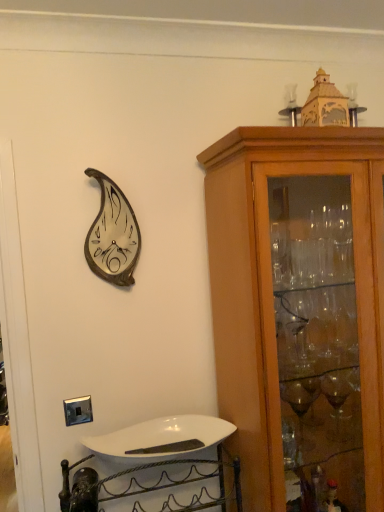
This screenshot has height=512, width=384. What do you see at coordinates (300, 311) in the screenshot?
I see `light brown wood cabinet at right` at bounding box center [300, 311].

Image resolution: width=384 pixels, height=512 pixels. Identify the location of white glossy sink at lower center. (155, 468).

The image size is (384, 512). I want to click on light brown wood cabinet at right, so click(x=300, y=311).

Looking at this image, is light brown wood cabinet at right smaller than metallic silver clock at upper left?

Actually, light brown wood cabinet at right might be larger than metallic silver clock at upper left.

From the image's perspective, would you say light brown wood cabinet at right is positioned over metallic silver clock at upper left?

Actually, light brown wood cabinet at right appears below metallic silver clock at upper left in the image.

Considering the points (366, 458) and (119, 202), which point is in front, point (366, 458) or point (119, 202)?

Point (366, 458)

Is metallic silver clock at upper left located within light brown wood cabinet at right?

No.

Do you think white glossy sink at lower center is within light brown wood cabinet at right, or outside of it?

white glossy sink at lower center lies outside light brown wood cabinet at right.

Between white glossy sink at lower center and light brown wood cabinet at right, which one has less height?

Standing shorter between the two is white glossy sink at lower center.

Does white glossy sink at lower center come behind light brown wood cabinet at right?

Yes, it is.

Does white glossy sink at lower center appear on the right side of light brown wood cabinet at right?

Incorrect, white glossy sink at lower center is not on the right side of light brown wood cabinet at right.

From a real-world perspective, is white glossy sink at lower center located higher than metallic silver clock at upper left?

No, from a real-world perspective, white glossy sink at lower center is not over metallic silver clock at upper left

Is white glossy sink at lower center oriented towards metallic silver clock at upper left?

No, white glossy sink at lower center does not turn towards metallic silver clock at upper left.

From the image's perspective, which is below, white glossy sink at lower center or metallic silver clock at upper left?

white glossy sink at lower center, from the image's perspective.

Which is behind, point (142, 469) or point (101, 277)?

The point (142, 469) is behind.

Is metallic silver clock at upper left spatially inside light brown wood cabinet at right, or outside of it?

metallic silver clock at upper left is not inside light brown wood cabinet at right, it's outside.

How many degrees apart are the facing directions of metallic silver clock at upper left and light brown wood cabinet at right?

There is a 1.32-degree angle between the facing directions of metallic silver clock at upper left and light brown wood cabinet at right.

Can you confirm if metallic silver clock at upper left is wider than light brown wood cabinet at right?

Incorrect, the width of metallic silver clock at upper left does not surpass that of light brown wood cabinet at right.

Does light brown wood cabinet at right lie in front of white glossy sink at lower center?

Yes, it is.

Would you say light brown wood cabinet at right is outside white glossy sink at lower center?

light brown wood cabinet at right lies outside white glossy sink at lower center's area.

Which is correct: metallic silver clock at upper left is inside white glossy sink at lower center, or outside of it?

metallic silver clock at upper left lies outside white glossy sink at lower center.

Does metallic silver clock at upper left have a greater height compared to white glossy sink at lower center?

Correct, metallic silver clock at upper left is much taller as white glossy sink at lower center.

Does metallic silver clock at upper left turn towards white glossy sink at lower center?

No, metallic silver clock at upper left does not turn towards white glossy sink at lower center.

The width and height of the screenshot is (384, 512). Identify the location of clock above the light brown wood cabinet at right (from the image's perspective). (113, 234).

This screenshot has width=384, height=512. Find the location of `sink behind the light brown wood cabinet at right`. sink behind the light brown wood cabinet at right is located at coordinates (155, 468).

Looking at this image, looking at the image, which one is located closer to light brown wood cabinet at right, white glossy sink at lower center or metallic silver clock at upper left?

Among the two, white glossy sink at lower center is located nearer to light brown wood cabinet at right.

Which object lies further to the anchor point light brown wood cabinet at right, metallic silver clock at upper left or white glossy sink at lower center?

Among the two, metallic silver clock at upper left is located further to light brown wood cabinet at right.

Which object lies further to the anchor point metallic silver clock at upper left, light brown wood cabinet at right or white glossy sink at lower center?

Among the two, white glossy sink at lower center is located further to metallic silver clock at upper left.

Estimate the real-world distances between objects in this image. Which object is further from white glossy sink at lower center, metallic silver clock at upper left or light brown wood cabinet at right?

The object further to white glossy sink at lower center is metallic silver clock at upper left.

Based on their spatial positions, is light brown wood cabinet at right or metallic silver clock at upper left closer to white glossy sink at lower center?

light brown wood cabinet at right.

Considering their positions, is white glossy sink at lower center positioned closer to metallic silver clock at upper left than light brown wood cabinet at right?

Among the two, light brown wood cabinet at right is located nearer to metallic silver clock at upper left.

Locate an element on the screen. sink between metallic silver clock at upper left and light brown wood cabinet at right is located at coordinates (155, 468).